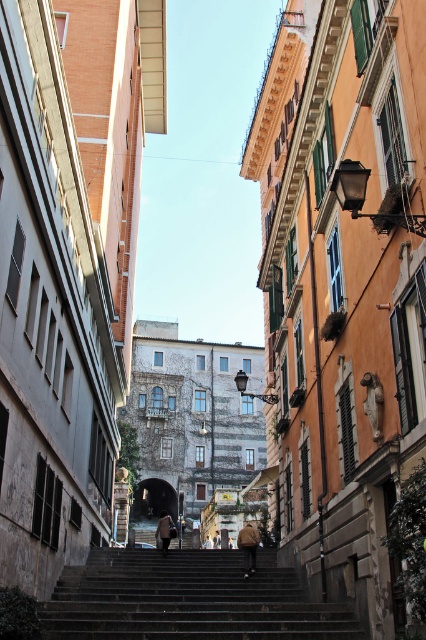
Question: Which object appears closest to the camera in this image?

Choices:
 (A) dark gray concrete stairs at center
 (B) brown leather coat at center

Answer: (A)

Question: Is dark gray concrete stairs at center to the right of light brown leather jacket at center from the viewer's perspective?

Choices:
 (A) no
 (B) yes

Answer: (A)

Question: Can you confirm if brown leather coat at center is positioned to the right of light brown leather jacket at center?

Choices:
 (A) no
 (B) yes

Answer: (A)

Question: Which point is closer to the camera?

Choices:
 (A) brown leather coat at center
 (B) light brown leather jacket at center
 (C) dark gray concrete stairs at center

Answer: (C)

Question: Is brown leather jacket at center positioned before light brown leather jacket at center?

Choices:
 (A) yes
 (B) no

Answer: (A)

Question: Which object is farther from the camera taking this photo?

Choices:
 (A) brown leather coat at center
 (B) light brown leather jacket at center
 (C) brown leather jacket at center
 (D) dark gray concrete stairs at center

Answer: (B)